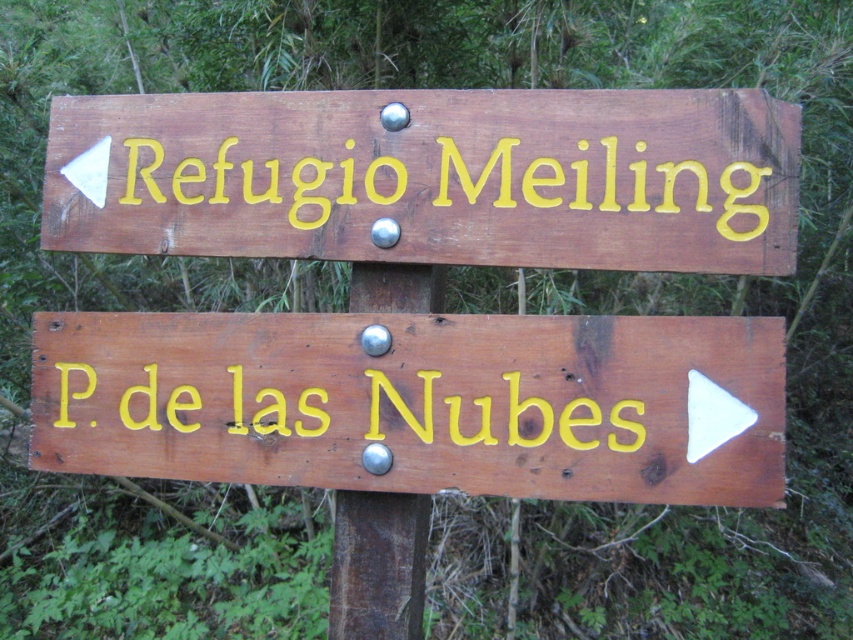
Can you confirm if wooden sign at lower right is positioned below yellow painted wood at center?

No.

The height and width of the screenshot is (640, 853). What do you see at coordinates (419, 403) in the screenshot? I see `wooden sign at lower right` at bounding box center [419, 403].

Locate an element on the screen. The image size is (853, 640). wooden sign at lower right is located at coordinates (419, 403).

Does yellow painted wood at center have a lesser height compared to brown wooden pole at center?

Yes.

Does yellow painted wood at center come in front of brown wooden pole at center?

Yes, it is in front of brown wooden pole at center.

This screenshot has width=853, height=640. In order to click on yellow painted wood at center in this screenshot , I will do point(341,408).

Where is `yellow painted wood at center`? yellow painted wood at center is located at coordinates click(x=341, y=408).

Is point (753, 234) closer to viewer compared to point (422, 547)?

Yes, it is.

Is yellow painted wood at upper center below brown wooden pole at center?

Actually, yellow painted wood at upper center is above brown wooden pole at center.

At what (x,y) coordinates should I click in order to perform the action: click on yellow painted wood at upper center. Please return your answer as a coordinate pair (x, y). The height and width of the screenshot is (640, 853). Looking at the image, I should click on (450, 186).

You are a GUI agent. You are given a task and a screenshot of the screen. Output one action in this format:
    pyautogui.click(x=<x>, y=<y>)
    Task: Click on the yellow painted wood at upper center
    
    Given the screenshot: What is the action you would take?
    pyautogui.click(x=450, y=186)